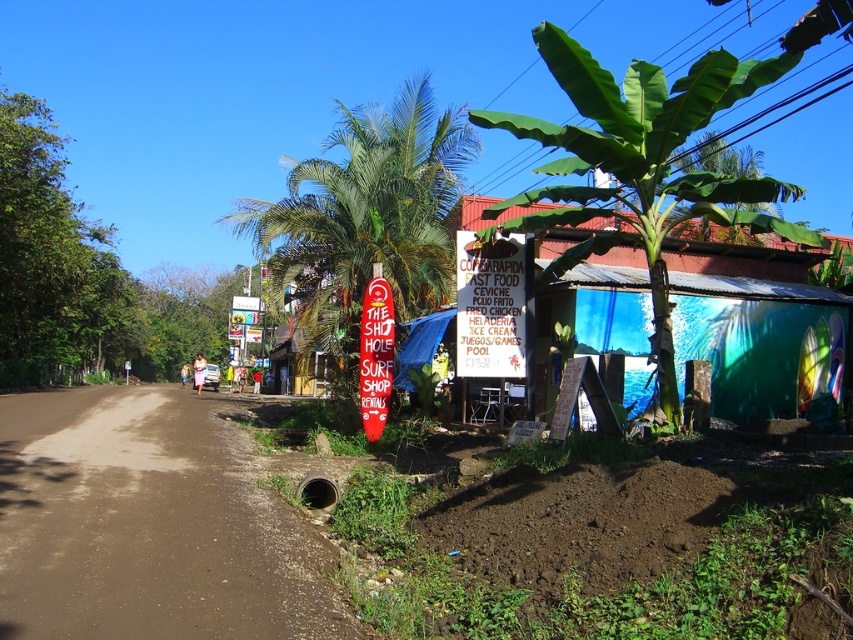
You are standing on the dirt road in the image and want to reach the signboard in front of the building. The point at coordinates point (618, 228) is part of your path. Is this point closer to you or farther than the signboard?

The point at coordinates point (618, 228) is 21.61 meters away from the viewer. Since the signboard is in front of the building, which is to the right of the road, the point is likely part of the path leading towards the signboard. However, without specific distance information about the signboard, we cannot definitively determine if the point is closer or farther than the signboard.

You are standing at the point with coordinates point (44,604) and want to walk towards the point (386,346). According to the scene, will you be moving towards the building with the underwater mural or away from it?

The point (44,604) is in front of the point (386,346). Since you are moving from a point that is in front towards the other point, you would be moving away from the building with the underwater mural.